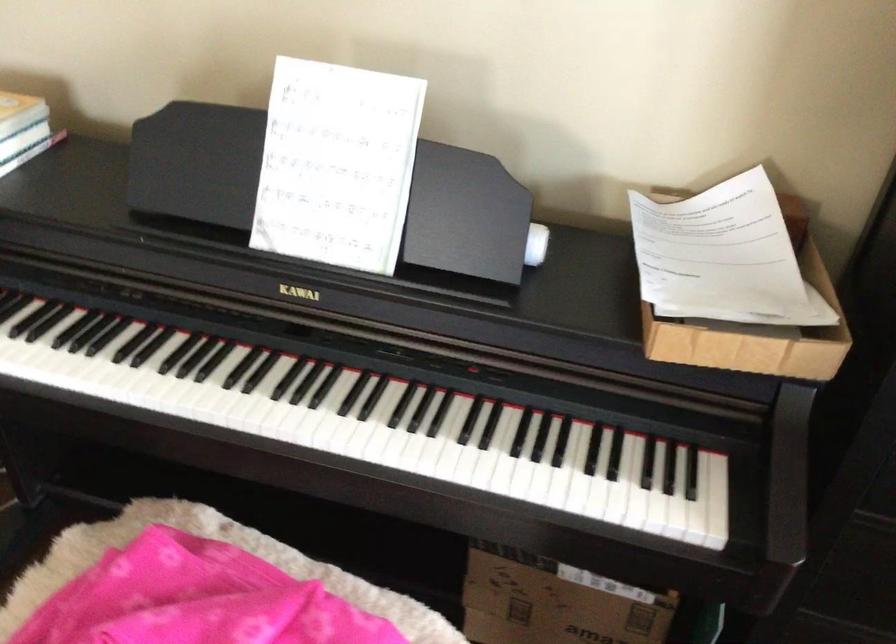
Describe the element at coordinates (536, 243) in the screenshot. Image resolution: width=896 pixels, height=644 pixels. I see `a white cylindrical object` at that location.